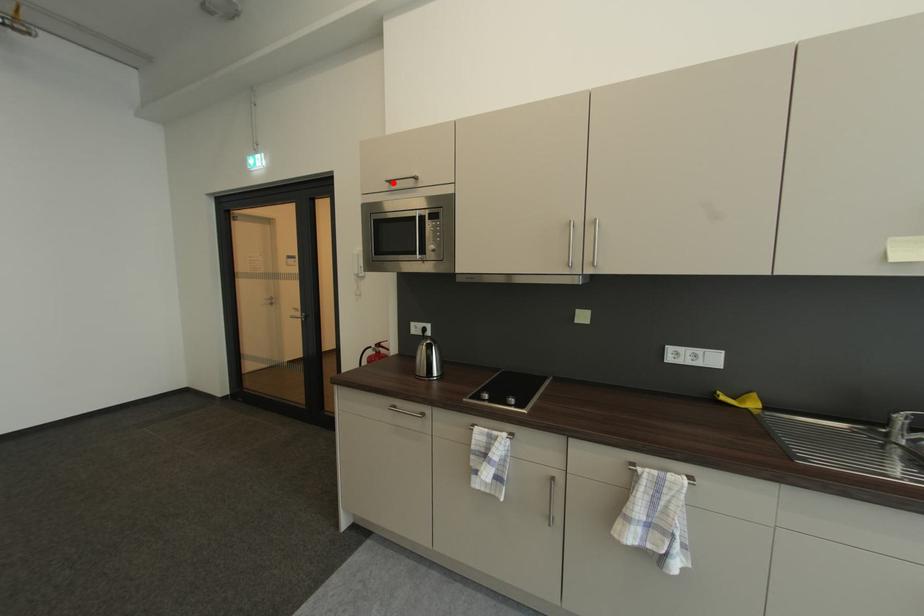
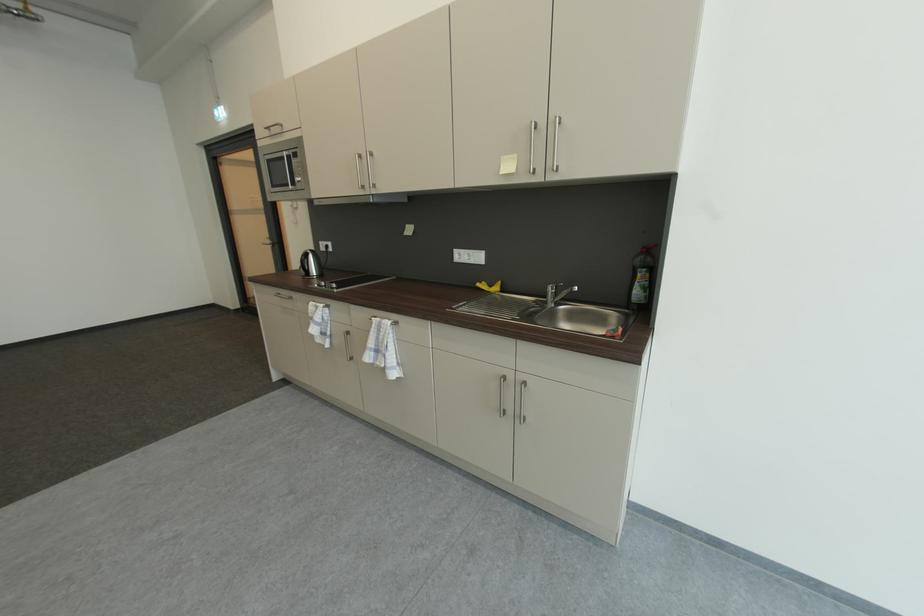
Locate, in the second image, the point that corresponds to the highlighted location in the first image.

(273, 130)